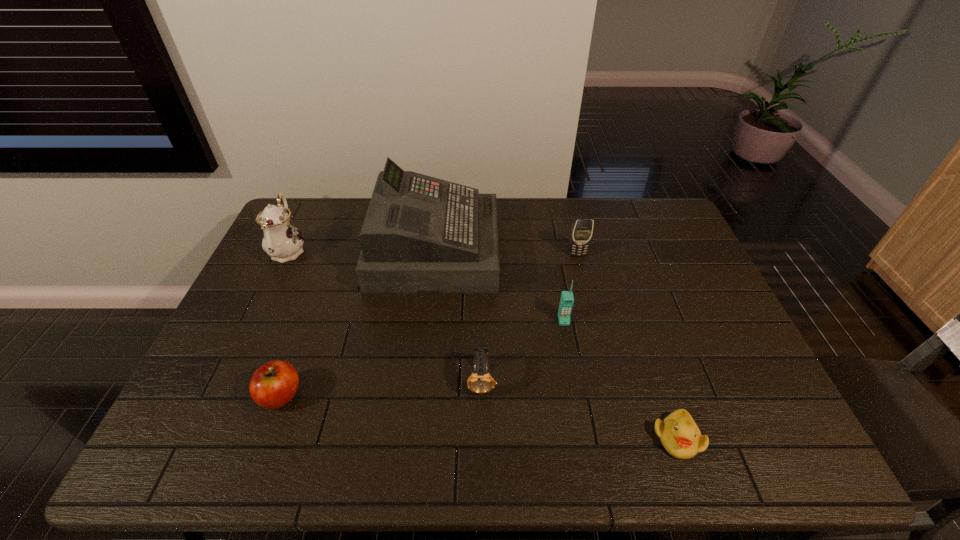
I want to click on empty space that is in between the leftmost object and the watch, so click(x=385, y=315).

Locate an element on the screen. free space between the watch and the second object from left to right is located at coordinates (381, 388).

Find the location of a particular element. The height and width of the screenshot is (540, 960). vacant point located between the nearer cellular telephone and the apple is located at coordinates (422, 358).

At what (x,y) coordinates should I click in order to perform the action: click on free area in between the chinaware and the watch. Please return your answer as a coordinate pair (x, y). The width and height of the screenshot is (960, 540). Looking at the image, I should click on (385, 315).

Identify the location of vacant area between the rightmost object and the second object from left to right. (479, 417).

Where is `object that is the fourth closest to the apple`? object that is the fourth closest to the apple is located at coordinates (567, 299).

Locate which object ranks fourth in proximity to the rightmost object. Please provide its 2D coordinates. Your answer should be formatted as a tuple, i.e. [(x, y)], where the tuple contains the x and y coordinates of a point satisfying the conditions above.

[(582, 229)]